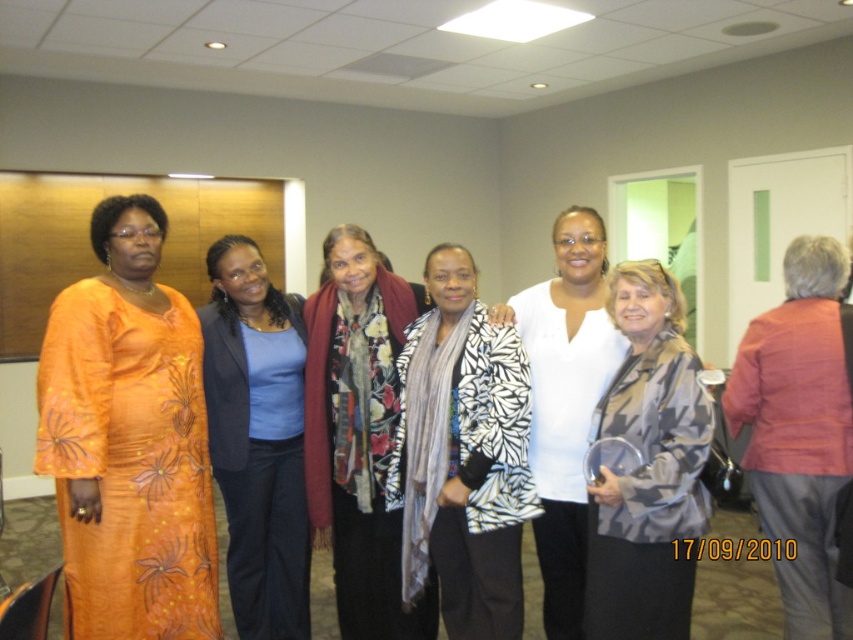
Question: Which object is the farthest from the blue fabric at center?

Choices:
 (A) white matte shirt at center
 (B) camouflage-patterned jacket at center
 (C) white and black leaf-patterned jacket at center
 (D) matte pink blazer at right

Answer: (D)

Question: Estimate the real-world distances between objects in this image. Which object is farther from the orange floral dress at left?

Choices:
 (A) camouflage-patterned jacket at center
 (B) matte pink blazer at right

Answer: (B)

Question: Can you confirm if floral scarf at center is positioned to the right of matte pink blazer at right?

Choices:
 (A) yes
 (B) no

Answer: (B)

Question: Can you confirm if blue fabric at center is positioned to the right of white matte shirt at center?

Choices:
 (A) yes
 (B) no

Answer: (B)

Question: Is white and black leaf-patterned jacket at center below blue fabric at center?

Choices:
 (A) no
 (B) yes

Answer: (A)

Question: Which point appears farthest from the camera in this image?

Choices:
 (A) (791, 396)
 (B) (169, 372)

Answer: (A)